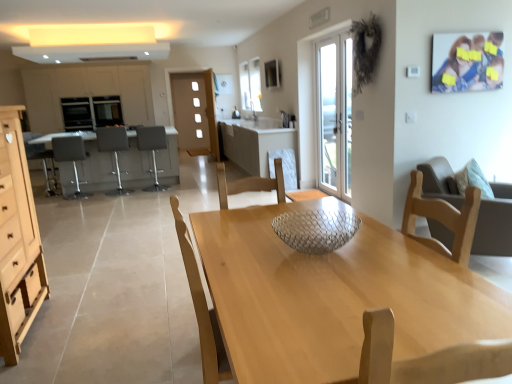
I want to click on white glossy exhaust hood at upper center, so click(x=93, y=53).

At what (x,y) coordinates should I click in order to perform the action: click on matte gray desk at center. Please return your answer as a coordinate pair (x, y). Looking at the image, I should click on [91, 163].

This screenshot has height=384, width=512. Identify the location of gray fabric bar stool at left, arranged as the 5th chair when viewed from the front. [x=41, y=159].

This screenshot has width=512, height=384. What are the coordinates of `gray fabric bar stool at center, acting as the 4th chair starting from the left` in the screenshot? It's located at (152, 150).

At what (x,y) coordinates should I click in order to perform the action: click on light wood table at center. Please return your answer as a coordinate pair (x, y). This screenshot has width=512, height=384. Looking at the image, I should click on (334, 296).

In order to click on white glossy exhaust hood at upper center in this screenshot , I will do `click(93, 53)`.

What's the angular difference between matte gray cabinetry at left, marked as the third cabinetry in a right-to-left arrangement, and matte black oven at left, which is the first appliance from left to right,'s facing directions?

The angle between the facing direction of matte gray cabinetry at left, marked as the third cabinetry in a right-to-left arrangement, and the facing direction of matte black oven at left, which is the first appliance from left to right, is 1.62 degrees.

Is matte gray cabinetry at left, marked as the third cabinetry in a right-to-left arrangement, oriented away from matte black oven at left, which is the first appliance from left to right?

Yes, matte gray cabinetry at left, marked as the third cabinetry in a right-to-left arrangement, is facing away from matte black oven at left, which is the first appliance from left to right.

Is matte gray cabinetry at left, positioned as the 3th cabinetry in front-to-back order, wider than matte black oven at left, which is the 2th appliance in right-to-left order?

Correct, the width of matte gray cabinetry at left, positioned as the 3th cabinetry in front-to-back order, exceeds that of matte black oven at left, which is the 2th appliance in right-to-left order.

Which object is further away from the camera, matte gray cabinetry at left, acting as the 1th cabinetry starting from the left, or matte black oven at left, which is the 2th appliance in right-to-left order?

matte black oven at left, which is the 2th appliance in right-to-left order, is behind.

Which is in front, gray fabric bar stool at center, acting as the 2th chair starting from the back, or clear glass bowl at center?

clear glass bowl at center is closer to the camera.

Would you say gray fabric bar stool at center, the fourth chair in the front-to-back sequence, is inside or outside clear glass bowl at center?

gray fabric bar stool at center, the fourth chair in the front-to-back sequence, exists outside the volume of clear glass bowl at center.

Is gray fabric bar stool at center, acting as the 4th chair starting from the left, to the left of clear glass bowl at center from the viewer's perspective?

Yes, gray fabric bar stool at center, acting as the 4th chair starting from the left, is to the left of clear glass bowl at center.

Is gray fabric bar stool at left, the second chair from the left, facing away from matte gray cabinetry at left, marked as the third cabinetry in a right-to-left arrangement?

That's not correct — gray fabric bar stool at left, the second chair from the left, is not looking away from matte gray cabinetry at left, marked as the third cabinetry in a right-to-left arrangement.

Is point (64, 141) positioned before point (140, 90)?

Yes, point (64, 141) is in front of point (140, 90).

Based on the photo, from a real-world perspective, which object rests below the other?

gray fabric bar stool at left, which is the 2th chair from front to back, is physically lower.

In the scene shown: Considering the sizes of objects gray fabric bar stool at left, which is counted as the fourth chair, starting from the back, and matte gray cabinetry at left, marked as the third cabinetry in a right-to-left arrangement, in the image provided, who is wider, gray fabric bar stool at left, which is counted as the fourth chair, starting from the back, or matte gray cabinetry at left, marked as the third cabinetry in a right-to-left arrangement,?

Wider between the two is matte gray cabinetry at left, marked as the third cabinetry in a right-to-left arrangement.

Is point (111, 148) closer or farther from the camera than point (42, 144)?

Point (111, 148) is positioned farther from the camera compared to point (42, 144).

From the image's perspective, does matte gray bar stool at center, which is counted as the third chair, starting from the front, appear lower than gray fabric bar stool at left, arranged as the first chair when viewed from the left?

Incorrect, from the image's perspective, matte gray bar stool at center, which is counted as the third chair, starting from the front, is higher than gray fabric bar stool at left, arranged as the first chair when viewed from the left.

You are a GUI agent. You are given a task and a screenshot of the screen. Output one action in this format:
    pyautogui.click(x=<x>, y=<y>)
    Task: Click on the 2nd chair to the right of the gray fabric bar stool at left, arranged as the first chair when viewed from the left, starting your count from the anchor
    This screenshot has height=384, width=512.
    Given the screenshot: What is the action you would take?
    pyautogui.click(x=114, y=151)

Does point (224, 131) lie in front of point (89, 193)?

No, it is not.

Can you confirm if white marble cabinet at center, which appears as the first cabinetry when viewed from the right, is wider than gray fabric bar stool at left, the second chair from the left?

Yes, white marble cabinet at center, which appears as the first cabinetry when viewed from the right, is wider than gray fabric bar stool at left, the second chair from the left.

Does white marble cabinet at center, which appears as the first cabinetry when viewed from the right, have a greater height compared to gray fabric bar stool at left, which is the fourth chair in right-to-left order?

Yes, white marble cabinet at center, which appears as the first cabinetry when viewed from the right, is taller than gray fabric bar stool at left, which is the fourth chair in right-to-left order.

Between point (39, 107) and point (44, 145), which one is positioned behind?

The point (39, 107) is behind.

Is matte gray cabinetry at left, arranged as the first cabinetry when viewed from the back, turned away from gray fabric bar stool at left, arranged as the first chair when viewed from the left?

No, matte gray cabinetry at left, arranged as the first cabinetry when viewed from the back, is not facing away from gray fabric bar stool at left, arranged as the first chair when viewed from the left.

Considering the sizes of matte gray cabinetry at left, marked as the third cabinetry in a right-to-left arrangement, and gray fabric bar stool at left, arranged as the first chair when viewed from the left, in the image, is matte gray cabinetry at left, marked as the third cabinetry in a right-to-left arrangement, bigger or smaller than gray fabric bar stool at left, arranged as the first chair when viewed from the left,?

In the image, matte gray cabinetry at left, marked as the third cabinetry in a right-to-left arrangement, appears to be larger than gray fabric bar stool at left, arranged as the first chair when viewed from the left.

Is matte gray cabinetry at left, acting as the 1th cabinetry starting from the left, shorter than gray fabric bar stool at left, which is counted as the 5th chair, starting from the right?

No, matte gray cabinetry at left, acting as the 1th cabinetry starting from the left, is not shorter than gray fabric bar stool at left, which is counted as the 5th chair, starting from the right.

Looking at their sizes, would you say gray fabric bar stool at left, arranged as the 5th chair when viewed from the front, is wider or thinner than light wood/wooden chair at right, marked as the 1th chair in a front-to-back arrangement?

gray fabric bar stool at left, arranged as the 5th chair when viewed from the front, is thinner than light wood/wooden chair at right, marked as the 1th chair in a front-to-back arrangement.

At what (x,y) coordinates should I click in order to perform the action: click on the 2nd chair above the light wood/wooden chair at right, the fifth chair positioned from the back (from a real-world perspective). Please return your answer as a coordinate pair (x, y). Image resolution: width=512 pixels, height=384 pixels. Looking at the image, I should click on (41, 159).

Considering the sizes of objects gray fabric bar stool at left, which is counted as the 5th chair, starting from the right, and light wood/wooden chair at right, the fifth chair positioned from the back, in the image provided, who is bigger, gray fabric bar stool at left, which is counted as the 5th chair, starting from the right, or light wood/wooden chair at right, the fifth chair positioned from the back,?

Bigger between the two is light wood/wooden chair at right, the fifth chair positioned from the back.

From a real-world perspective, is gray fabric bar stool at left, arranged as the first chair when viewed from the left, beneath light wood/wooden chair at right, which is the 1th chair in right-to-left order?

No, from a real-world perspective, gray fabric bar stool at left, arranged as the first chair when viewed from the left, is not under light wood/wooden chair at right, which is the 1th chair in right-to-left order.

Identify the location of the 1st cabinetry in front of the matte black oven at left, which is the first appliance from left to right. The image size is (512, 384). (86, 92).

From a real-world perspective, starting from the clear glass bowl at center, which chair is the 2nd one below it? Please provide its 2D coordinates.

[(152, 150)]

Estimate the real-world distances between objects in this image. Which object is closer to matte black oven at left, the 2th appliance when ordered from left to right, white marble cabinet at center, which is counted as the second cabinetry, starting from the back, or wooden drawer at lower left, arranged as the 2th drawer when viewed from the back?

white marble cabinet at center, which is counted as the second cabinetry, starting from the back.

Which object lies nearer to the anchor point white glass door at center, light wood table at center or matte brown drawer at lower left, which is the second drawer from front to back?

The object closer to white glass door at center is light wood table at center.

Estimate the real-world distances between objects in this image. Which object is closer to gray fabric bar stool at center, acting as the 2th chair starting from the back, white marble cabinet at center, which is counted as the second cabinetry, starting from the back, or matte gray desk at center?

matte gray desk at center lies closer to gray fabric bar stool at center, acting as the 2th chair starting from the back, than the other object.

Which object lies nearer to the anchor point white marble cabinet at center, the 2th cabinetry viewed from the front, matte black oven at left, placed as the 1th appliance when sorted from right to left, or light wood dresser at left, the 2th cabinetry viewed from the left?

matte black oven at left, placed as the 1th appliance when sorted from right to left, is closer to white marble cabinet at center, the 2th cabinetry viewed from the front.

Looking at this image, from the image, which object appears to be nearer to light wood/wooden chair at right, marked as the 1th chair in a front-to-back arrangement, white glass door at center or matte brown drawer at lower left, the 1th drawer in the back-to-front sequence?

white glass door at center is positioned closer to the anchor light wood/wooden chair at right, marked as the 1th chair in a front-to-back arrangement.

When comparing their distances from white marble cabinet at center, which appears as the first cabinetry when viewed from the right, does white glass door at center or white glossy exhaust hood at upper center seem further?

white glossy exhaust hood at upper center is positioned further to the anchor white marble cabinet at center, which appears as the first cabinetry when viewed from the right.

Looking at the image, which one is located further to matte gray desk at center, light wood/wooden chair at right, which is the 1th chair in right-to-left order, or gray fabric bar stool at left, arranged as the first chair when viewed from the left?

light wood/wooden chair at right, which is the 1th chair in right-to-left order, is further to matte gray desk at center.

Looking at the image, which one is located further to light wood/wooden chair at right, the fifth chair positioned from the back, matte gray desk at center or clear glass bowl at center?

Based on the image, matte gray desk at center appears to be further to light wood/wooden chair at right, the fifth chair positioned from the back.

What are the coordinates of `glass door located between clear glass bowl at center and matte black oven at left, which is the 2th appliance in right-to-left order, in the depth direction` in the screenshot? It's located at (335, 113).

The height and width of the screenshot is (384, 512). What are the coordinates of `couple between light wood dresser at left, the 2th cabinetry viewed from the left, and matte black oven at left, which is the first appliance from left to right, along the z-axis` in the screenshot? It's located at (467, 62).

This screenshot has width=512, height=384. Identify the location of glass door located between white glossy exhaust hood at upper center and matte plastic photo frame at upper right in the left-right direction. (335, 113).

Where is `couple located between light wood dresser at left, which is counted as the 1th cabinetry, starting from the front, and white marble cabinet at center, the 2th cabinetry viewed from the front, in the depth direction`? This screenshot has width=512, height=384. couple located between light wood dresser at left, which is counted as the 1th cabinetry, starting from the front, and white marble cabinet at center, the 2th cabinetry viewed from the front, in the depth direction is located at coordinates (467, 62).